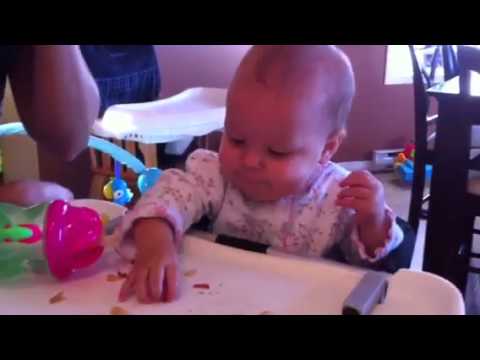
The image size is (480, 360). In order to click on high chair surface in this screenshot , I will do `click(289, 287)`.